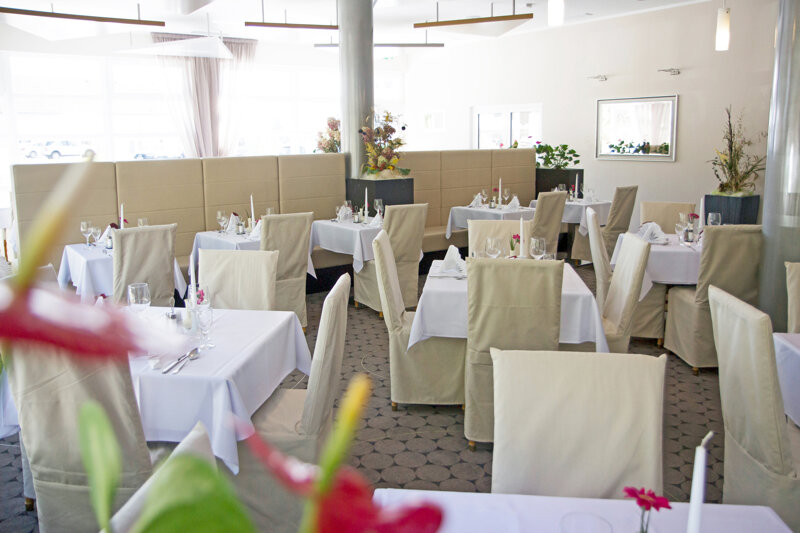
I want to click on small pink flowers in small vases, so click(646, 490), click(518, 239), click(498, 188), click(688, 216), click(126, 220), click(205, 289), click(232, 213).